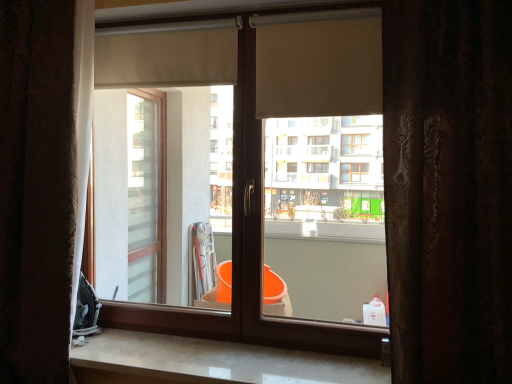
Where is `brown textured curtain at right, the second curtain in the back-to-front sequence`? This screenshot has width=512, height=384. brown textured curtain at right, the second curtain in the back-to-front sequence is located at coordinates (448, 189).

Find the location of a particular element. This screenshot has width=512, height=384. beige fabric roller at upper center, the first shutter viewed from the right is located at coordinates (319, 64).

The image size is (512, 384). I want to click on matte wood window at center, so click(x=246, y=257).

This screenshot has width=512, height=384. What do you see at coordinates (36, 189) in the screenshot? I see `brown textured curtain at left, which appears as the 2th curtain when viewed from the front` at bounding box center [36, 189].

What is the approximate width of beige fabric roller at upper left, which is the 1th shutter in back-to-front order?

The width of beige fabric roller at upper left, which is the 1th shutter in back-to-front order, is 3.30 inches.

Find the location of a particular element. brown textured curtain at right, the second curtain in the back-to-front sequence is located at coordinates [x=448, y=189].

Between point (134, 74) and point (70, 134), which one is positioned behind?

Positioned behind is point (134, 74).

How much distance is there between beige fabric roller at upper left, which is the 1th shutter in back-to-front order, and brown textured curtain at left, acting as the 1th curtain starting from the left?

They are 19.09 inches apart.

In the scene shown: From a real-world perspective, is beige fabric roller at upper left, which appears as the 2th shutter when viewed from the right, located beneath brown textured curtain at left, marked as the 1th curtain in a back-to-front arrangement?

No.

Is brown textured curtain at right, which appears as the first curtain when viewed from the right, situated inside white marble counter top at lower center or outside?

brown textured curtain at right, which appears as the first curtain when viewed from the right, is located beyond the bounds of white marble counter top at lower center.

Which of these two, brown textured curtain at right, the second curtain in the back-to-front sequence, or white marble counter top at lower center, is smaller?

With smaller size is white marble counter top at lower center.

Does brown textured curtain at right, which appears as the first curtain when viewed from the right, turn towards white marble counter top at lower center?

No, brown textured curtain at right, which appears as the first curtain when viewed from the right, is not turned towards white marble counter top at lower center.

How different are the orientations of beige fabric roller at upper center, the 1th shutter when ordered from front to back, and white marble counter top at lower center in degrees?

There is a 1.92-degree angle between the facing directions of beige fabric roller at upper center, the 1th shutter when ordered from front to back, and white marble counter top at lower center.

Is beige fabric roller at upper center, the second shutter viewed from the back, oriented away from white marble counter top at lower center?

That's not correct — beige fabric roller at upper center, the second shutter viewed from the back, is not looking away from white marble counter top at lower center.

Between beige fabric roller at upper center, which appears as the second shutter when viewed from the left, and white marble counter top at lower center, which one has smaller size?

beige fabric roller at upper center, which appears as the second shutter when viewed from the left, is smaller.

Would you consider beige fabric roller at upper center, the first shutter viewed from the right, to be distant from white marble counter top at lower center?

Absolutely, beige fabric roller at upper center, the first shutter viewed from the right, is distant from white marble counter top at lower center.

How many degrees apart are the facing directions of matte wood window at center and white marble counter top at lower center?

They differ by 0.000522 degrees in their facing directions.

Is matte wood window at center oriented away from white marble counter top at lower center?

No, white marble counter top at lower center is not at the back of matte wood window at center.

Considering the positions of objects matte wood window at center and white marble counter top at lower center in the image provided, who is behind, matte wood window at center or white marble counter top at lower center?

matte wood window at center is further away from the camera.

Which object is more forward, white marble counter top at lower center or beige fabric roller at upper left, the first shutter from the left?

Positioned in front is white marble counter top at lower center.

From the picture: Does white marble counter top at lower center have a greater width compared to beige fabric roller at upper left, the 2th shutter in the front-to-back sequence?

Indeed, white marble counter top at lower center has a greater width compared to beige fabric roller at upper left, the 2th shutter in the front-to-back sequence.

From a real-world perspective, is white marble counter top at lower center positioned under beige fabric roller at upper left, the 2th shutter in the front-to-back sequence, based on gravity?

Yes, from a real-world perspective, white marble counter top at lower center is below beige fabric roller at upper left, the 2th shutter in the front-to-back sequence.

Can you confirm if beige fabric roller at upper center, the 1th shutter when ordered from front to back, is positioned to the left of matte wood window at center?

In fact, beige fabric roller at upper center, the 1th shutter when ordered from front to back, is to the right of matte wood window at center.

Between beige fabric roller at upper center, the first shutter viewed from the right, and matte wood window at center, which one has smaller size?

Smaller between the two is beige fabric roller at upper center, the first shutter viewed from the right.

Considering their positions, is beige fabric roller at upper center, the second shutter viewed from the back, located in front of or behind matte wood window at center?

Clearly, beige fabric roller at upper center, the second shutter viewed from the back, is behind matte wood window at center.

Image resolution: width=512 pixels, height=384 pixels. What are the coordinates of `counter top below the matte wood window at center (from the image's perspective)` in the screenshot? It's located at (211, 362).

Is white marble counter top at lower center bigger or smaller than matte wood window at center?

Considering their sizes, white marble counter top at lower center takes up less space than matte wood window at center.

From the image's perspective, is white marble counter top at lower center located above or below matte wood window at center?

From the image's perspective, white marble counter top at lower center appears below matte wood window at center.

Which is correct: white marble counter top at lower center is inside matte wood window at center, or outside of it?

white marble counter top at lower center exists outside the volume of matte wood window at center.

From the image's perspective, starting from the brown textured curtain at left, which is counted as the 2th curtain, starting from the right, which shutter is the 2nd one above? Please provide its 2D coordinates.

[(167, 54)]

The width and height of the screenshot is (512, 384). I want to click on curtain in front of the white marble counter top at lower center, so click(x=448, y=189).

Estimate the real-world distances between objects in this image. Which object is further from brown textured curtain at right, the second curtain in the back-to-front sequence, matte wood window at center or brown textured curtain at left, which is counted as the 2th curtain, starting from the right?

brown textured curtain at left, which is counted as the 2th curtain, starting from the right.

Looking at the image, which one is located closer to matte wood window at center, white marble counter top at lower center or beige fabric roller at upper left, the 2th shutter in the front-to-back sequence?

white marble counter top at lower center lies closer to matte wood window at center than the other object.

Estimate the real-world distances between objects in this image. Which object is further from brown textured curtain at right, which is counted as the first curtain, starting from the front, matte wood window at center or beige fabric roller at upper left, which appears as the 2th shutter when viewed from the right?

beige fabric roller at upper left, which appears as the 2th shutter when viewed from the right.

Estimate the real-world distances between objects in this image. Which object is closer to beige fabric roller at upper center, the first shutter viewed from the right, beige fabric roller at upper left, the 2th shutter in the front-to-back sequence, or brown textured curtain at right, which appears as the first curtain when viewed from the right?

beige fabric roller at upper left, the 2th shutter in the front-to-back sequence, is closer to beige fabric roller at upper center, the first shutter viewed from the right.

Based on their spatial positions, is brown textured curtain at right, the second curtain in the back-to-front sequence, or brown textured curtain at left, which appears as the 2th curtain when viewed from the front, further from white marble counter top at lower center?

Among the two, brown textured curtain at right, the second curtain in the back-to-front sequence, is located further to white marble counter top at lower center.

Based on the photo, based on their spatial positions, is white marble counter top at lower center or matte wood window at center further from brown textured curtain at left, acting as the 1th curtain starting from the left?

white marble counter top at lower center.

Based on their spatial positions, is brown textured curtain at right, the second curtain in the back-to-front sequence, or beige fabric roller at upper center, the second shutter viewed from the back, closer to brown textured curtain at left, acting as the 1th curtain starting from the left?

The object closer to brown textured curtain at left, acting as the 1th curtain starting from the left, is beige fabric roller at upper center, the second shutter viewed from the back.

Looking at the image, which one is located closer to white marble counter top at lower center, beige fabric roller at upper center, which appears as the second shutter when viewed from the left, or brown textured curtain at left, marked as the 1th curtain in a back-to-front arrangement?

brown textured curtain at left, marked as the 1th curtain in a back-to-front arrangement, is closer to white marble counter top at lower center.

At what (x,y) coordinates should I click in order to perform the action: click on window between brown textured curtain at left, acting as the 1th curtain starting from the left, and beige fabric roller at upper center, the 1th shutter when ordered from front to back, from left to right. Please return your answer as a coordinate pair (x, y). The image size is (512, 384). Looking at the image, I should click on (246, 257).

This screenshot has height=384, width=512. Find the location of `window between beige fabric roller at upper left, which is the 1th shutter in back-to-front order, and beige fabric roller at upper center, the 1th shutter when ordered from front to back, in the horizontal direction`. window between beige fabric roller at upper left, which is the 1th shutter in back-to-front order, and beige fabric roller at upper center, the 1th shutter when ordered from front to back, in the horizontal direction is located at coordinates (246, 257).

Find the location of a particular element. This screenshot has height=384, width=512. shutter between brown textured curtain at left, which is counted as the 2th curtain, starting from the right, and beige fabric roller at upper center, the first shutter viewed from the right, in the horizontal direction is located at coordinates (167, 54).

The width and height of the screenshot is (512, 384). In order to click on window that lies between beige fabric roller at upper left, which appears as the 2th shutter when viewed from the right, and white marble counter top at lower center from top to bottom in this screenshot , I will do `click(246, 257)`.